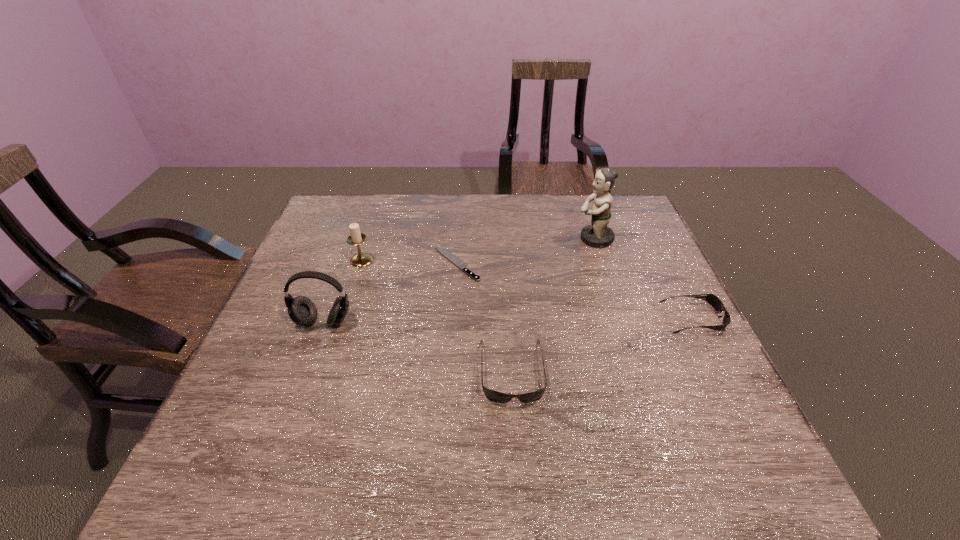
At what (x,y) coordinates should I click in order to perform the action: click on sunglasses at the right edge. Please return your answer as a coordinate pair (x, y). This screenshot has height=540, width=960. Looking at the image, I should click on (714, 301).

This screenshot has height=540, width=960. In order to click on figurine situated at the right edge in this screenshot , I will do `click(597, 234)`.

Find the location of a particular element. The height and width of the screenshot is (540, 960). object present at the far right corner is located at coordinates (597, 234).

Image resolution: width=960 pixels, height=540 pixels. In order to click on free space at the far edge in this screenshot , I will do `click(429, 215)`.

At what (x,y) coordinates should I click in order to perform the action: click on free region at the near edge. Please return your answer as a coordinate pair (x, y). Image resolution: width=960 pixels, height=540 pixels. Looking at the image, I should click on (619, 435).

I want to click on vacant position at the left edge of the desktop, so click(316, 264).

You are a GUI agent. You are given a task and a screenshot of the screen. Output one action in this format:
    pyautogui.click(x=<x>, y=<y>)
    Task: Click on the vacant space at the right edge
    This screenshot has width=960, height=540.
    Given the screenshot: What is the action you would take?
    pyautogui.click(x=648, y=303)

The image size is (960, 540). Find the location of `vacant space at the far right corner of the desktop`. vacant space at the far right corner of the desktop is located at coordinates (622, 196).

You are a GUI agent. You are given a task and a screenshot of the screen. Output one action in this format:
    pyautogui.click(x=<x>, y=<y>)
    Task: Click on the vacant space at the near right corner of the desktop
    The image size is (960, 540).
    Given the screenshot: What is the action you would take?
    pyautogui.click(x=685, y=436)

At what (x,y) coordinates should I click in order to perform the action: click on vacant region between the figurine and the headset. Please return your answer as a coordinate pair (x, y). The image size is (960, 540). Looking at the image, I should click on (459, 280).